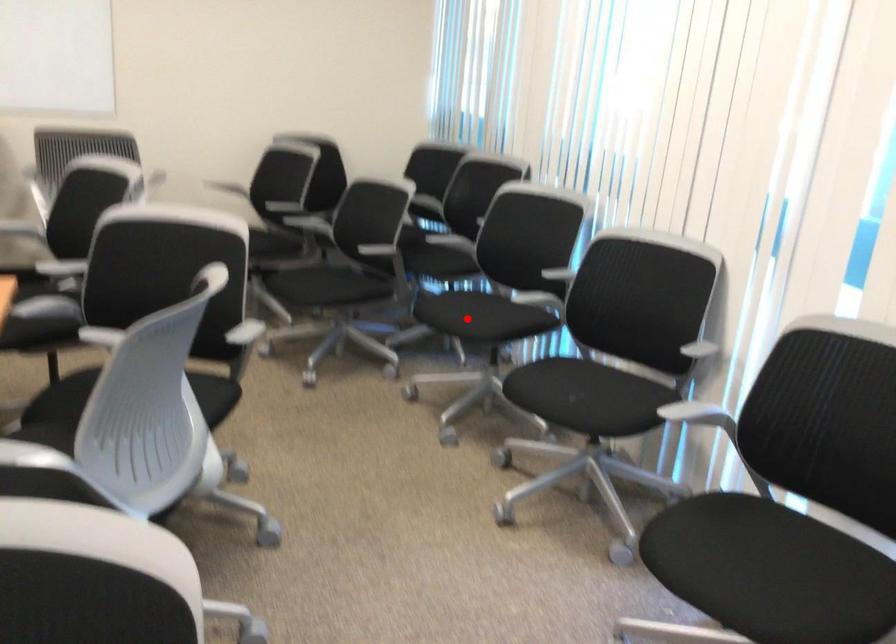
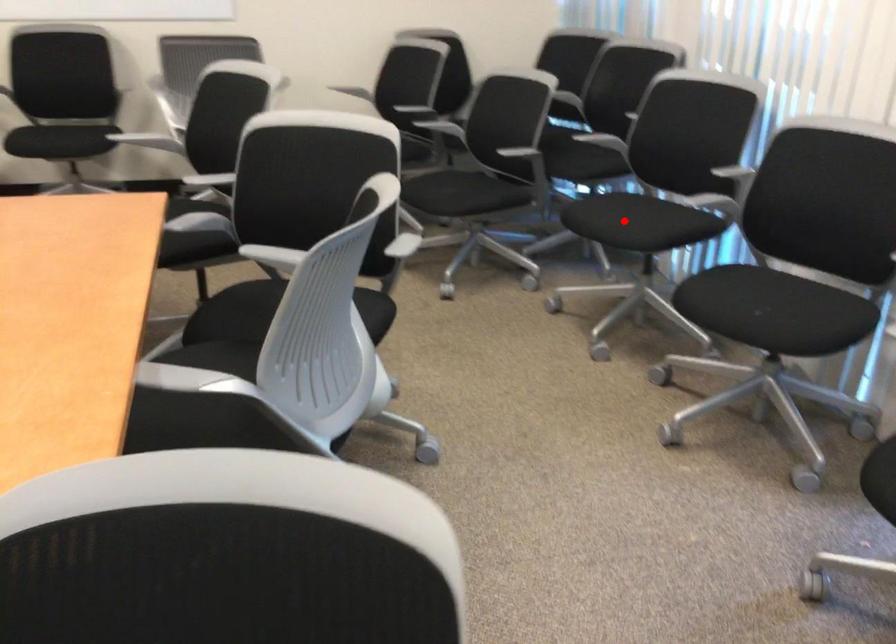
I am providing you with two images of the same scene from different viewpoints. A red point is marked on the first image and another point is marked on the second image. Does the point marked in image1 correspond to the same location as the one in image2?

Yes